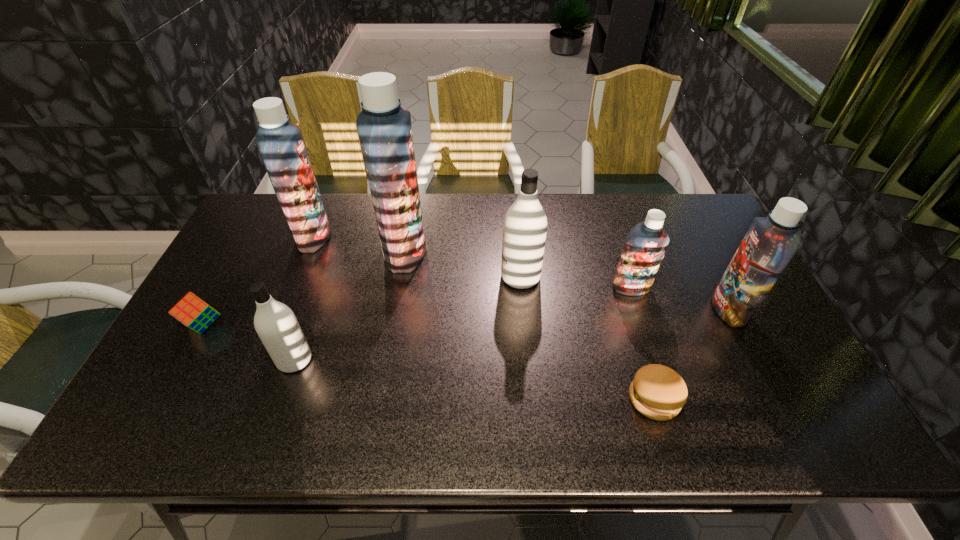
Select which blue shampoo appears as the third closest to the third shampoo from right to left. Please provide its 2D coordinates. Your answer should be formatted as a tuple, i.e. [(x, y)], where the tuple contains the x and y coordinates of a point satisfying the conditions above.

[(770, 243)]

Locate an element on the screen. This screenshot has height=540, width=960. free space that satisfies the following two spatial constraints: 1. on the front-facing side of the seventh farthest object; 2. on the right side of the shortest object is located at coordinates (281, 399).

Identify the location of free space that satisfies the following two spatial constraints: 1. on the back side of the hamburger; 2. on the front label of the seventh shortest object. (606, 237).